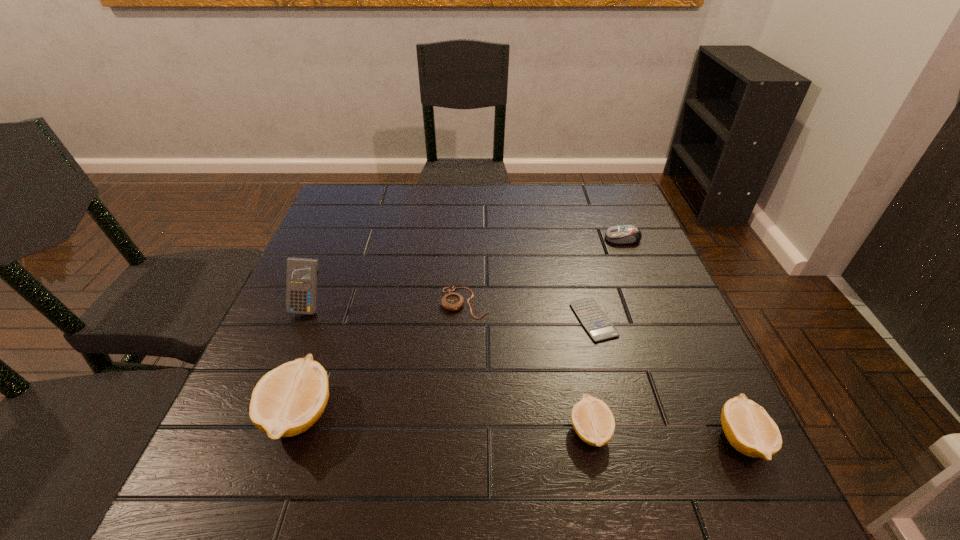
This screenshot has width=960, height=540. I want to click on vacant space at the near edge of the desktop, so click(474, 431).

The width and height of the screenshot is (960, 540). What are the coordinates of `free space at the right edge` in the screenshot? It's located at (663, 328).

This screenshot has width=960, height=540. In order to click on vacant area at the far left corner of the desktop in this screenshot , I will do `click(372, 218)`.

Find the location of a particular element. free region at the far right corner is located at coordinates (617, 219).

Locate an element on the screen. vacant space at the near right corner of the desktop is located at coordinates (718, 414).

I want to click on empty space between the shortest object and the third tallest object, so (x=667, y=380).

Where is `free spot between the second lemon from left to right and the right calculator`? The width and height of the screenshot is (960, 540). free spot between the second lemon from left to right and the right calculator is located at coordinates (591, 375).

Find the location of a particular element. This screenshot has height=540, width=960. unoccupied area between the shortest object and the left calculator is located at coordinates (451, 313).

Identify the location of empty space between the shortest lemon and the pocket watch. (527, 367).

The width and height of the screenshot is (960, 540). Find the location of `vacant area between the shortest object and the fifth shortest object`. vacant area between the shortest object and the fifth shortest object is located at coordinates (667, 380).